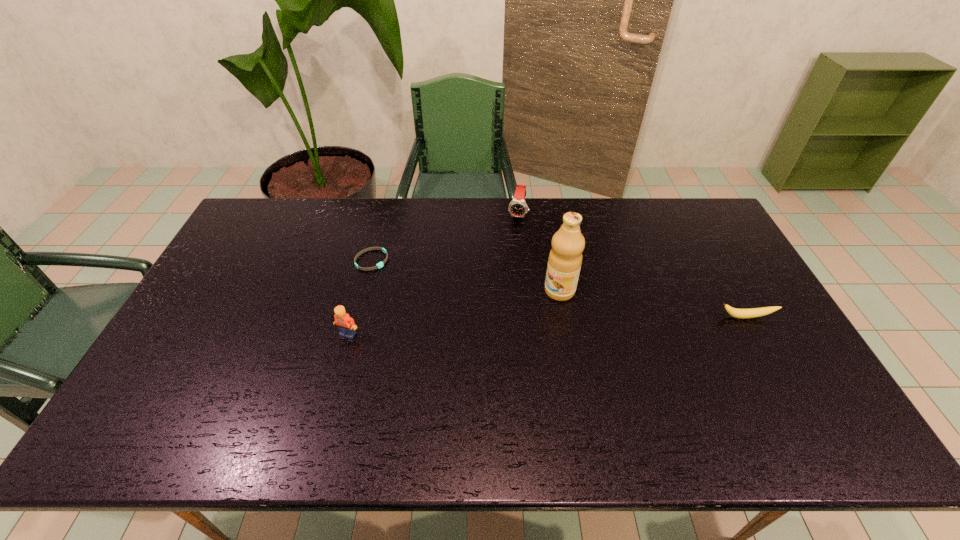
Where is `object that is at the far edge`? Image resolution: width=960 pixels, height=540 pixels. object that is at the far edge is located at coordinates (518, 208).

Identify the location of object situated at the right edge. The width and height of the screenshot is (960, 540). (734, 312).

In the image, there is a desktop. Where is `vacant space at the far edge`? vacant space at the far edge is located at coordinates (344, 210).

I want to click on free region at the near edge of the desktop, so click(502, 394).

At what (x,y) coordinates should I click in order to perform the action: click on free space at the left edge of the desktop. Please return your answer as a coordinate pair (x, y). The height and width of the screenshot is (540, 960). Looking at the image, I should click on (247, 241).

Identify the location of free region at the right edge of the desktop. The width and height of the screenshot is (960, 540). (753, 334).

This screenshot has width=960, height=540. Identify the location of free region at the near left corner. (176, 399).

You are a GUI agent. You are given a task and a screenshot of the screen. Output one action in this format:
    pyautogui.click(x=<x>, y=<y>)
    Task: Click on the free space that is in between the nearest object and the fourth farthest object
    
    Given the screenshot: What is the action you would take?
    pyautogui.click(x=547, y=326)

This screenshot has width=960, height=540. Find the location of `free space that is in between the Lego and the rightmost object`. free space that is in between the Lego and the rightmost object is located at coordinates (547, 326).

Where is `free space between the farthest object and the second shortest object`? The width and height of the screenshot is (960, 540). free space between the farthest object and the second shortest object is located at coordinates (632, 266).